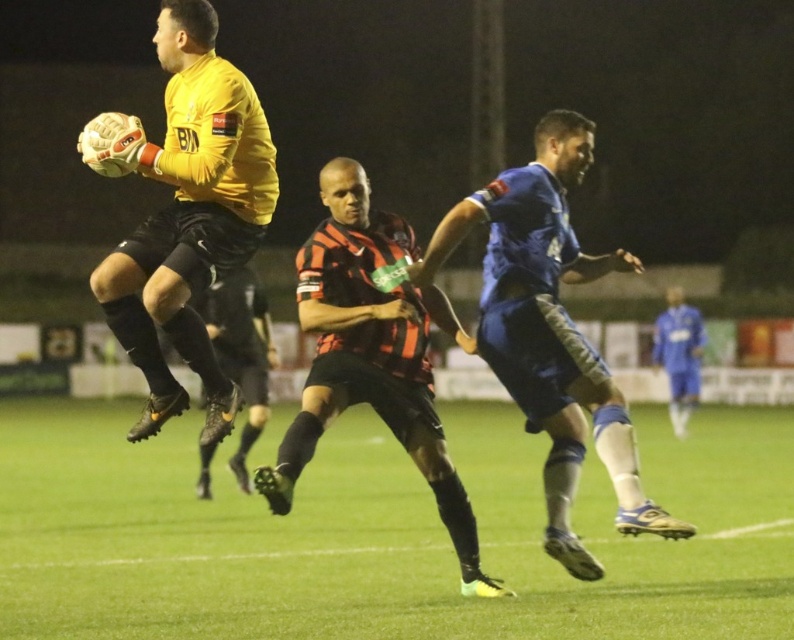
Measure the distance between point (341, 472) and camera.

A distance of 16.40 meters exists between point (341, 472) and camera.

Who is more forward, (41,566) or (141,227)?

Point (141,227) is more forward.

Is point (775, 440) positioned before point (145, 228)?

No.

The image size is (794, 640). I want to click on green grass at center, so click(384, 532).

Which is more to the right, green grass at center or black and red striped jersey at center?

green grass at center

Between point (311, 492) and point (430, 376), which one is positioned in front?

Point (430, 376) is in front.

The height and width of the screenshot is (640, 794). I want to click on green grass at center, so click(x=384, y=532).

Who is shorter, blue fabric shorts at center or black matte soccer cleat at center?

With less height is blue fabric shorts at center.

Is blue fabric shorts at center positioned at the back of black matte soccer cleat at center?

No.

Who is more forward, (488,262) or (241,392)?

Point (488,262)

Locate an element on the screen. The height and width of the screenshot is (640, 794). blue fabric shorts at center is located at coordinates (550, 330).